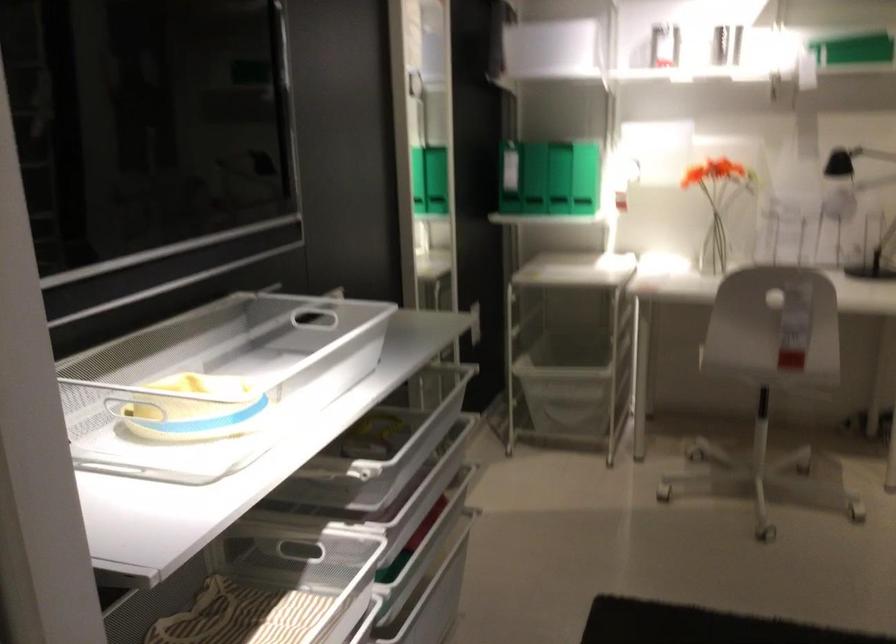
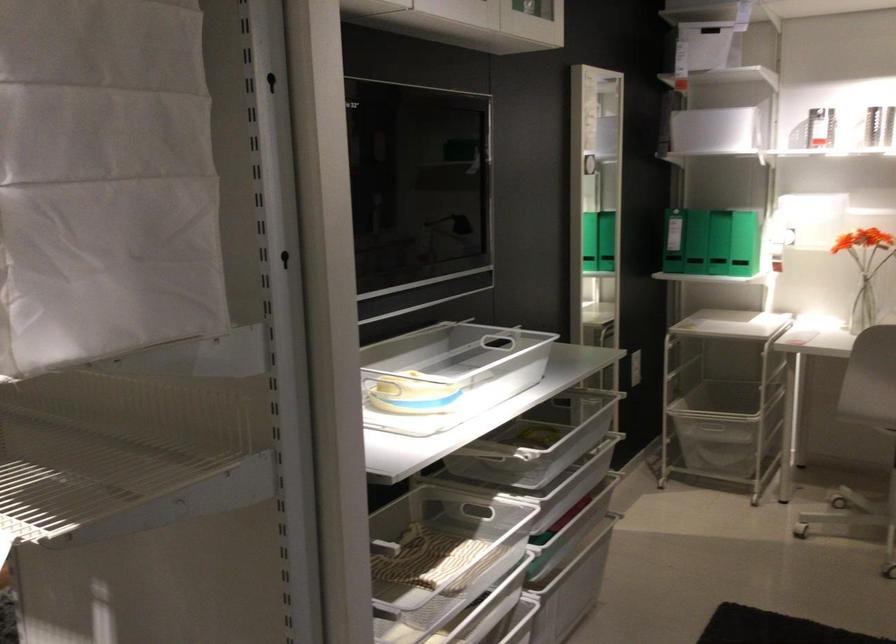
The point at [722,327] is marked in the first image. Where is the corresponding point in the second image?

(869, 379)